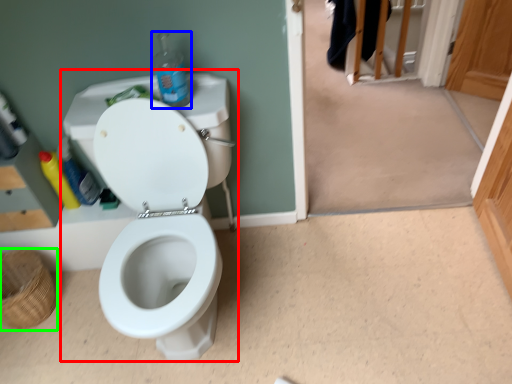
Question: Considering the real-world distances, which object is farthest from sink (highlighted by a red box)? bottle (highlighted by a blue box) or basket (highlighted by a green box)?

Choices:
 (A) bottle
 (B) basket

Answer: (B)